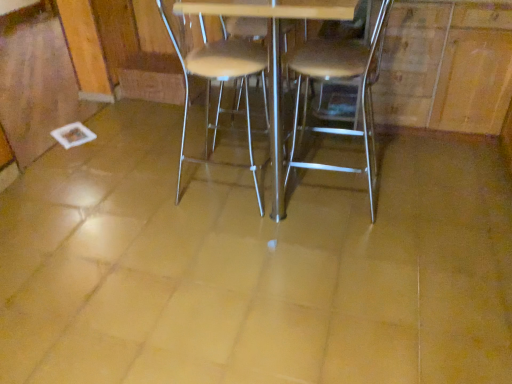
Find the location of a particular element. The width and height of the screenshot is (512, 384). free space to the left of metallic silver table at center is located at coordinates (142, 171).